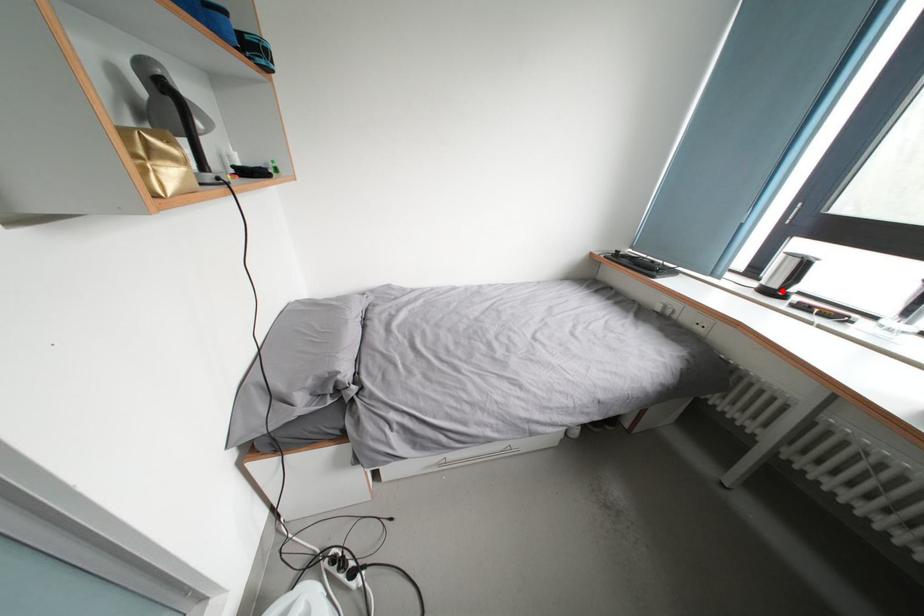
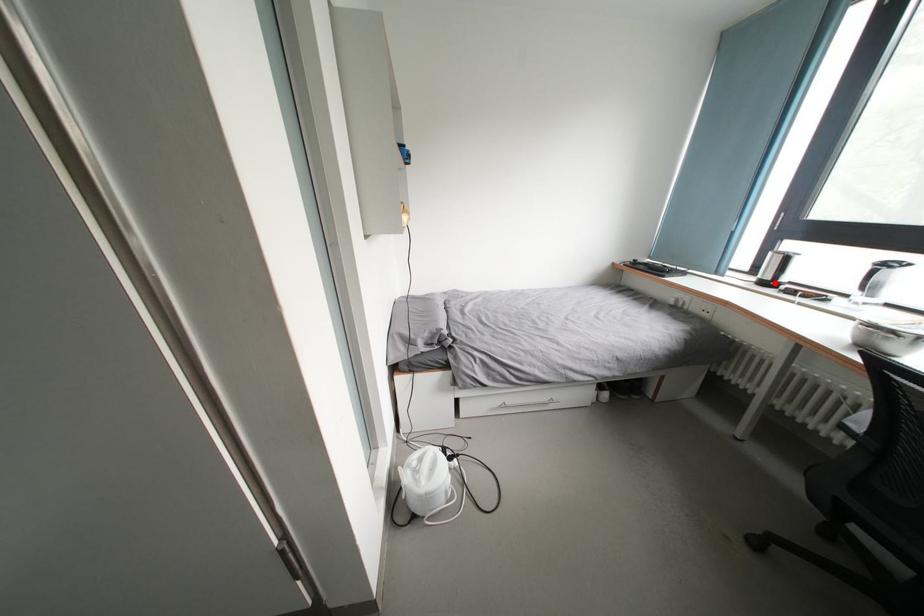
I am providing you with two images of the same scene from different viewpoints. A red point is marked on the first image and another point is marked on the second image. Is the red point in image1 aligned with the point shown in image2?

Yes